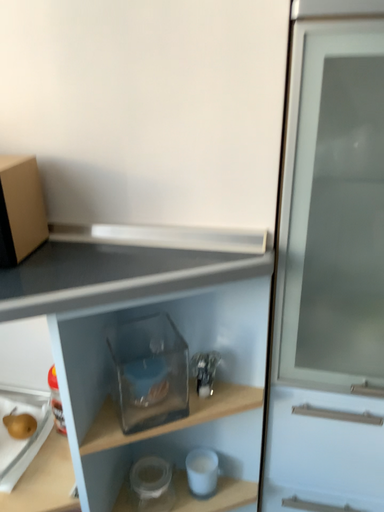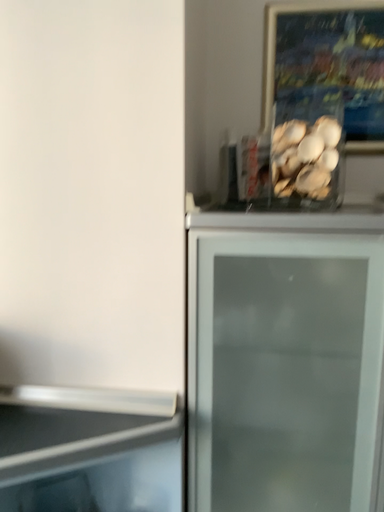
Question: Which way did the camera rotate in the video?

Choices:
 (A) rotated upward
 (B) rotated downward

Answer: (A)